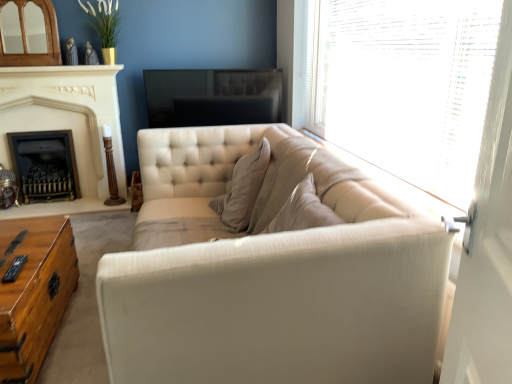
Question: From the image's perspective, is satin beige couch at center on white stone fireplace at left, the 2th fireplace in the left-to-right sequence?

Choices:
 (A) yes
 (B) no

Answer: (B)

Question: Would you consider satin beige couch at center to be distant from white stone fireplace at left, the 2th fireplace in the left-to-right sequence?

Choices:
 (A) yes
 (B) no

Answer: (A)

Question: Is satin beige couch at center wider than white stone fireplace at left, positioned as the 1th fireplace in right-to-left order?

Choices:
 (A) yes
 (B) no

Answer: (A)

Question: Is satin beige couch at center smaller than white stone fireplace at left, positioned as the 1th fireplace in right-to-left order?

Choices:
 (A) yes
 (B) no

Answer: (B)

Question: Does satin beige couch at center have a lesser height compared to white stone fireplace at left, positioned as the 1th fireplace in right-to-left order?

Choices:
 (A) yes
 (B) no

Answer: (A)

Question: Does satin beige couch at center have a greater height compared to white stone fireplace at left, positioned as the 1th fireplace in right-to-left order?

Choices:
 (A) yes
 (B) no

Answer: (B)

Question: Is white stone fireplace at left, positioned as the 1th fireplace in right-to-left order, positioned behind wooden trunk at lower left?

Choices:
 (A) yes
 (B) no

Answer: (A)

Question: Would you say white stone fireplace at left, positioned as the 1th fireplace in right-to-left order, contains wooden trunk at lower left?

Choices:
 (A) no
 (B) yes

Answer: (A)

Question: Can you confirm if white stone fireplace at left, the 2th fireplace in the left-to-right sequence, is smaller than wooden trunk at lower left?

Choices:
 (A) no
 (B) yes

Answer: (B)

Question: From the image's perspective, is white stone fireplace at left, positioned as the 1th fireplace in right-to-left order, under wooden trunk at lower left?

Choices:
 (A) no
 (B) yes

Answer: (A)

Question: Is white stone fireplace at left, the 2th fireplace in the left-to-right sequence, outside wooden trunk at lower left?

Choices:
 (A) no
 (B) yes

Answer: (B)

Question: Can you confirm if white stone fireplace at left, positioned as the 1th fireplace in right-to-left order, is taller than wooden trunk at lower left?

Choices:
 (A) yes
 (B) no

Answer: (A)

Question: Can you confirm if translucent wood blinds at upper right is shorter than white stone fireplace at left, the 2th fireplace in the left-to-right sequence?

Choices:
 (A) no
 (B) yes

Answer: (B)